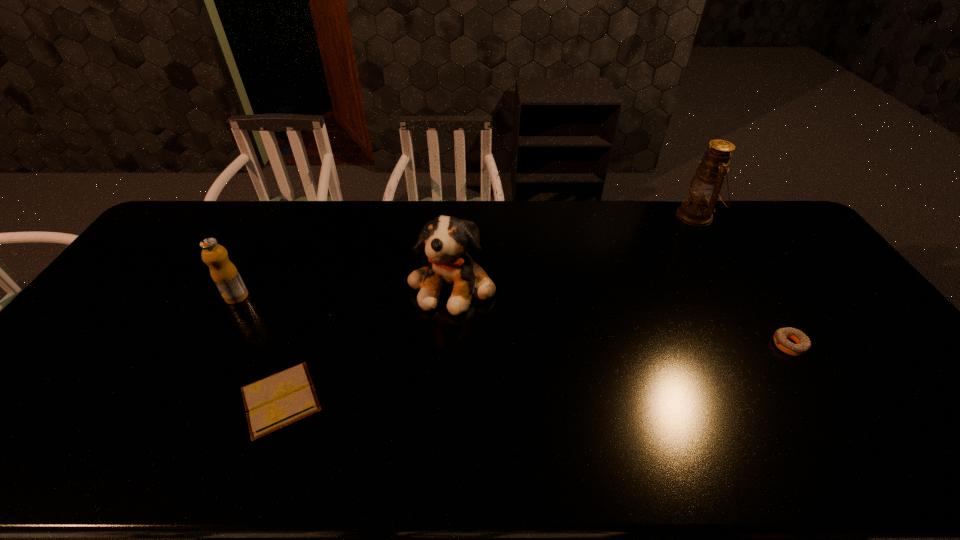
Locate an element on the screen. The width and height of the screenshot is (960, 540). free space that is in between the doughnut and the leftmost object is located at coordinates (513, 321).

Where is `free space between the second nearest object and the shortest object`? This screenshot has width=960, height=540. free space between the second nearest object and the shortest object is located at coordinates (535, 373).

What are the coordinates of `free space between the fruit juice and the puppy` in the screenshot? It's located at (345, 291).

Image resolution: width=960 pixels, height=540 pixels. Find the location of `free area in between the third object from right to left and the shortest object`. free area in between the third object from right to left and the shortest object is located at coordinates (367, 342).

Locate an element on the screen. Image resolution: width=960 pixels, height=540 pixels. vacant area that lies between the nearest object and the oil lamp is located at coordinates (489, 308).

The height and width of the screenshot is (540, 960). I want to click on free space between the diary and the fourth tallest object, so click(x=535, y=373).

I want to click on vacant region between the leftmost object and the third object from right to left, so click(345, 291).

You are a GUI agent. You are given a task and a screenshot of the screen. Output one action in this format:
    pyautogui.click(x=<x>, y=<y>)
    Task: Click on the unoccupied position between the oil lamp and the fourth tallest object
    
    Given the screenshot: What is the action you would take?
    pyautogui.click(x=743, y=281)

Where is `vacant point located between the puppy and the doughnut`? This screenshot has width=960, height=540. vacant point located between the puppy and the doughnut is located at coordinates (621, 315).

You are a GUI agent. You are given a task and a screenshot of the screen. Output one action in this format:
    pyautogui.click(x=<x>, y=<y>)
    Task: Click on the object that stands as the third closest to the fourth farthest object
    
    Given the screenshot: What is the action you would take?
    click(277, 401)